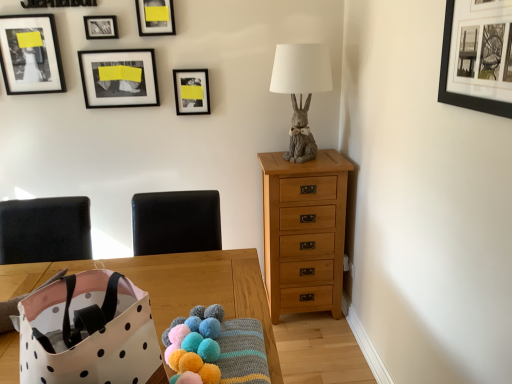
What do you see at coordinates (176, 222) in the screenshot? I see `black leather armchair at center` at bounding box center [176, 222].

In order to face wooden table at center, should I rotate leftwards or rightwards?

A 19.581 degree turn to the left will do.

What are the coordinates of `wooden table at center` in the screenshot? It's located at (175, 286).

Image resolution: width=512 pixels, height=384 pixels. Find the location of `matte gray rabbit at upper right`. matte gray rabbit at upper right is located at coordinates (301, 90).

What do you see at coordinates (89, 332) in the screenshot? I see `white polka dot fabric bag at lower left` at bounding box center [89, 332].

Where is `matte black picture frame at upper center, which is the third picture frame from front to back`? matte black picture frame at upper center, which is the third picture frame from front to back is located at coordinates (155, 17).

Describe the element at coordinates (101, 27) in the screenshot. This screenshot has width=512, height=384. I see `metallic silver picture frame at upper center, which is the 5th picture frame in right-to-left order` at that location.

This screenshot has width=512, height=384. Describe the element at coordinates (459, 93) in the screenshot. I see `black matte picture frame at upper right, which appears as the 1th picture frame when viewed from the right` at that location.

Find the location of a particular element. The width and height of the screenshot is (512, 384). fluffy yarn balls at lower center is located at coordinates (195, 336).

Considering the relative positions of black leather armchair at center and white polka dot fabric bag at lower left in the image provided, is black leather armchair at center to the right of white polka dot fabric bag at lower left from the viewer's perspective?

Correct, you'll find black leather armchair at center to the right of white polka dot fabric bag at lower left.

Measure the distance between black leather armchair at center and white polka dot fabric bag at lower left.

35.41 inches.

Is black leather armchair at center in front of white polka dot fabric bag at lower left?

No.

From a real-world perspective, count 4th picture frames upward from the fluffy yarn balls at lower center and point to it. Please provide its 2D coordinates.

[(30, 54)]

Can we say matte black picture frame at upper left, which appears as the 1th picture frame when viewed from the left, lies outside fluffy yarn balls at lower center?

Absolutely, matte black picture frame at upper left, which appears as the 1th picture frame when viewed from the left, is external to fluffy yarn balls at lower center.

Considering the positions of objects matte black picture frame at upper left, which appears as the 2th picture frame when viewed from the front, and fluffy yarn balls at lower center in the image provided, who is behind, matte black picture frame at upper left, which appears as the 2th picture frame when viewed from the front, or fluffy yarn balls at lower center?

matte black picture frame at upper left, which appears as the 2th picture frame when viewed from the front.

Can you confirm if matte black picture frame at upper left, which ranks as the fifth picture frame in back-to-front order, is positioned to the right of fluffy yarn balls at lower center?

No, matte black picture frame at upper left, which ranks as the fifth picture frame in back-to-front order, is not to the right of fluffy yarn balls at lower center.

Where is `armchair above the wooden table at center (from the image's perspective)`? armchair above the wooden table at center (from the image's perspective) is located at coordinates [x=176, y=222].

From the image's perspective, is black leather armchair at center under wooden table at center?

No.

Which object is further away from the camera, black leather armchair at center or wooden table at center?

black leather armchair at center is further from the camera.

In the scene shown: Does black leather armchair at center turn towards wooden table at center?

No, black leather armchair at center is not oriented towards wooden table at center.

In the scene shown: From a real-world perspective, which object rests below the other?

From a 3D spatial view, white polka dot fabric bag at lower left is below.

Between matte black picture frame at upper center, arranged as the sixth picture frame when viewed from the front, and white polka dot fabric bag at lower left, which one has larger size?

white polka dot fabric bag at lower left is bigger.

Considering the points (207, 81) and (39, 333), which point is in front, point (207, 81) or point (39, 333)?

The point (39, 333) is in front.

Does matte black picture frame at upper center, the 2th picture frame positioned from the right, appear on the left side of white polka dot fabric bag at lower left?

Incorrect, matte black picture frame at upper center, the 2th picture frame positioned from the right, is not on the left side of white polka dot fabric bag at lower left.

From the picture: Considering the relative positions of white polka dot fabric bag at lower left and matte gray rabbit at upper right in the image provided, is white polka dot fabric bag at lower left in front of matte gray rabbit at upper right?

Yes, white polka dot fabric bag at lower left is closer to the camera.

From a real-world perspective, is white polka dot fabric bag at lower left located beneath matte gray rabbit at upper right?

Yes.

Is white polka dot fabric bag at lower left not within matte gray rabbit at upper right?

Yes.

Is white polka dot fabric bag at lower left facing away from matte gray rabbit at upper right?

That's not correct — white polka dot fabric bag at lower left is not looking away from matte gray rabbit at upper right.

Is black matte picture frame at upper right, which ranks as the 1th picture frame in front-to-back order, aimed at matte black picture frame at upper left, the third picture frame from the left?

No, black matte picture frame at upper right, which ranks as the 1th picture frame in front-to-back order, is not aimed at matte black picture frame at upper left, the third picture frame from the left.

From a real-world perspective, is black matte picture frame at upper right, which appears as the 1th picture frame when viewed from the right, below matte black picture frame at upper left, arranged as the second picture frame when viewed from the back?

No.

In order to click on the 4th picture frame behind when counting from the black matte picture frame at upper right, which appears as the 1th picture frame when viewed from the right in this screenshot , I will do `click(119, 78)`.

Are black matte picture frame at upper right, the 6th picture frame viewed from the left, and matte black picture frame at upper left, the third picture frame from the left, located far from each other?

Yes, black matte picture frame at upper right, the 6th picture frame viewed from the left, is far from matte black picture frame at upper left, the third picture frame from the left.

Choose the correct answer: Is matte black picture frame at upper center, arranged as the sixth picture frame when viewed from the front, inside fluffy yarn balls at lower center or outside it?

matte black picture frame at upper center, arranged as the sixth picture frame when viewed from the front, is not enclosed by fluffy yarn balls at lower center.

Based on the photo, does matte black picture frame at upper center, which is the 1th picture frame from back to front, have a greater height compared to fluffy yarn balls at lower center?

Yes.

Are matte black picture frame at upper center, arranged as the sixth picture frame when viewed from the front, and fluffy yarn balls at lower center beside each other?

They are not placed beside each other.

Is point (202, 105) positioned in front of point (217, 320)?

That is False.

You are a GUI agent. You are given a task and a screenshot of the screen. Output one action in this format:
    pyautogui.click(x=<x>, y=<y>)
    Task: Click on the gift bag below the black leather armchair at center (from the image's perspective)
    
    Given the screenshot: What is the action you would take?
    pyautogui.click(x=89, y=332)

At what (x,y) coordinates should I click in order to perform the action: click on stuff located underneath the matte black picture frame at upper left, which appears as the 2th picture frame when viewed from the front (from a real-world perspective). Please return your answer as a coordinate pair (x, y). The width and height of the screenshot is (512, 384). Looking at the image, I should click on (195, 336).

From the image, which object appears to be nearer to metallic silver picture frame at upper center, which is the 5th picture frame in right-to-left order, fluffy yarn balls at lower center or matte black picture frame at upper center, which is the third picture frame from front to back?

matte black picture frame at upper center, which is the third picture frame from front to back, is closer to metallic silver picture frame at upper center, which is the 5th picture frame in right-to-left order.

From the image, which object appears to be nearer to wooden table at center, fluffy yarn balls at lower center or metallic silver picture frame at upper center, which is the 5th picture frame in right-to-left order?

fluffy yarn balls at lower center is closer to wooden table at center.

When comparing their distances from matte gray rabbit at upper right, does matte black picture frame at upper left, which appears as the 1th picture frame when viewed from the left, or fluffy yarn balls at lower center seem further?

fluffy yarn balls at lower center is further to matte gray rabbit at upper right.

Looking at the image, which one is located closer to matte black picture frame at upper left, arranged as the second picture frame when viewed from the back, matte gray rabbit at upper right or matte black picture frame at upper left, which ranks as the fifth picture frame in back-to-front order?

matte black picture frame at upper left, which ranks as the fifth picture frame in back-to-front order.

When comparing their distances from white polka dot fabric bag at lower left, does fluffy yarn balls at lower center or matte black picture frame at upper left, which appears as the 2th picture frame when viewed from the front, seem closer?

fluffy yarn balls at lower center lies closer to white polka dot fabric bag at lower left than the other object.

Estimate the real-world distances between objects in this image. Which object is further from light brown wood chest of drawers at right, white polka dot fabric bag at lower left or matte black picture frame at upper center, the fifth picture frame when ordered from left to right?

The object further to light brown wood chest of drawers at right is white polka dot fabric bag at lower left.

Looking at the image, which one is located closer to matte black picture frame at upper center, acting as the 4th picture frame starting from the left, fluffy yarn balls at lower center or wooden table at center?

The object closer to matte black picture frame at upper center, acting as the 4th picture frame starting from the left, is wooden table at center.

Based on their spatial positions, is white polka dot fabric bag at lower left or light brown wood chest of drawers at right further from black leather armchair at center?

white polka dot fabric bag at lower left is further to black leather armchair at center.

The width and height of the screenshot is (512, 384). Identify the location of armchair between metallic silver picture frame at upper center, which is counted as the second picture frame, starting from the left, and wooden table at center, in the vertical direction. (176, 222).

At what (x,y) coordinates should I click in order to perform the action: click on table lamp located between matte black picture frame at upper left, arranged as the second picture frame when viewed from the back, and light brown wood chest of drawers at right in the left-right direction. Please return your answer as a coordinate pair (x, y). Looking at the image, I should click on (301, 90).

Identify the location of armchair between black matte picture frame at upper right, the 6th picture frame viewed from the left, and matte black picture frame at upper center, arranged as the sixth picture frame when viewed from the front, in the front-back direction. (176, 222).

Locate an element on the screen. table located between black matte picture frame at upper right, which ranks as the 1th picture frame in front-to-back order, and matte black picture frame at upper left, which is counted as the 5th picture frame, starting from the front, in the depth direction is located at coordinates (175, 286).